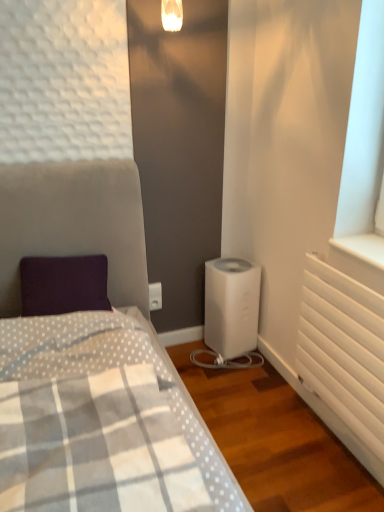
Question: From a real-world perspective, is white plastic water heater at lower center positioned under white plastic electric outlet at center based on gravity?

Choices:
 (A) no
 (B) yes

Answer: (B)

Question: Is white plastic water heater at lower center turned away from white plastic electric outlet at center?

Choices:
 (A) no
 (B) yes

Answer: (A)

Question: Considering the relative sizes of white plastic water heater at lower center and white plastic electric outlet at center in the image provided, is white plastic water heater at lower center shorter than white plastic electric outlet at center?

Choices:
 (A) no
 (B) yes

Answer: (A)

Question: Is white plastic water heater at lower center positioned in front of white plastic electric outlet at center?

Choices:
 (A) no
 (B) yes

Answer: (B)

Question: Would you say white plastic water heater at lower center is outside white plastic electric outlet at center?

Choices:
 (A) yes
 (B) no

Answer: (A)

Question: Can you confirm if white plastic water heater at lower center is taller than white plastic electric outlet at center?

Choices:
 (A) no
 (B) yes

Answer: (B)

Question: Is white plastic electric outlet at center not within white plastic water heater at lower center?

Choices:
 (A) no
 (B) yes

Answer: (B)

Question: Does white plastic electric outlet at center appear on the right side of white plastic water heater at lower center?

Choices:
 (A) yes
 (B) no

Answer: (B)

Question: Is white plastic electric outlet at center wider than white plastic water heater at lower center?

Choices:
 (A) yes
 (B) no

Answer: (B)

Question: Does white plastic electric outlet at center appear on the left side of white plastic water heater at lower center?

Choices:
 (A) no
 (B) yes

Answer: (B)

Question: Is white plastic electric outlet at center looking in the opposite direction of white plastic water heater at lower center?

Choices:
 (A) yes
 (B) no

Answer: (B)

Question: From the image's perspective, is white plastic electric outlet at center on top of white plastic water heater at lower center?

Choices:
 (A) no
 (B) yes

Answer: (B)

Question: From the image's perspective, is white matte radiator at right located above white plastic water heater at lower center?

Choices:
 (A) yes
 (B) no

Answer: (B)